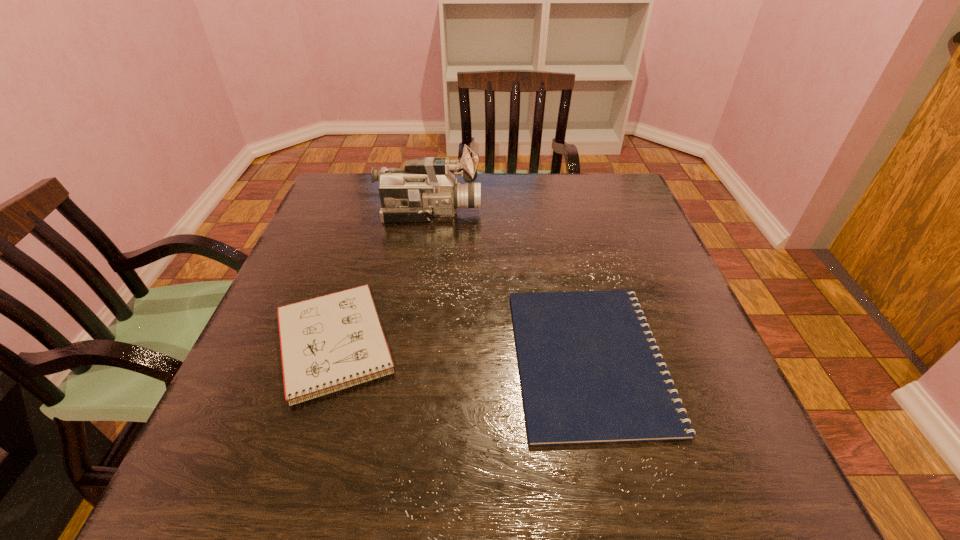
Locate an element on the screen. The image size is (960, 540). the tallest object is located at coordinates (426, 188).

At what (x,y) coordinates should I click in order to perform the action: click on the farthest object. Please return your answer as a coordinate pair (x, y). Looking at the image, I should click on (426, 188).

You are a GUI agent. You are given a task and a screenshot of the screen. Output one action in this format:
    pyautogui.click(x=<x>, y=<y>)
    Task: Click on the second tallest object
    The image size is (960, 540).
    Given the screenshot: What is the action you would take?
    pyautogui.click(x=328, y=343)

At what (x,y) coordinates should I click in order to perform the action: click on the left notepad. Please return your answer as a coordinate pair (x, y). This screenshot has height=540, width=960. Looking at the image, I should click on (328, 343).

The image size is (960, 540). I want to click on the right notepad, so click(590, 370).

Find the location of a particular element. the shorter notepad is located at coordinates (590, 370).

At what (x,y) coordinates should I click in order to perform the action: click on vacant area situated 0.270m on the front-facing side of the tallest object. Please return your answer as a coordinate pair (x, y). This screenshot has width=960, height=540. Looking at the image, I should click on (580, 212).

Find the location of `vacant space located on the right of the second shortest object`. vacant space located on the right of the second shortest object is located at coordinates (556, 345).

The width and height of the screenshot is (960, 540). In order to click on vacant space situated 0.090m on the back of the rightmost object in this screenshot , I will do `click(568, 267)`.

Locate an element on the screen. This screenshot has width=960, height=540. object present at the far edge is located at coordinates (426, 188).